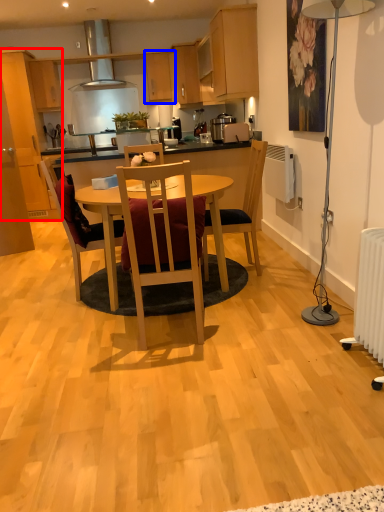
Question: Among these objects, which one is farthest to the camera, cabinetry (highlighted by a red box) or cabinetry (highlighted by a blue box)?

Choices:
 (A) cabinetry
 (B) cabinetry

Answer: (B)